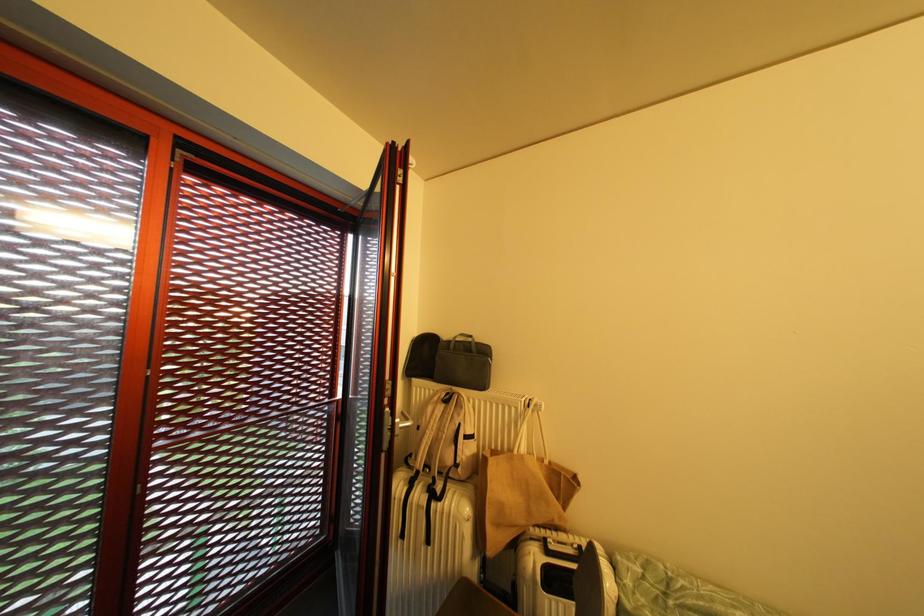
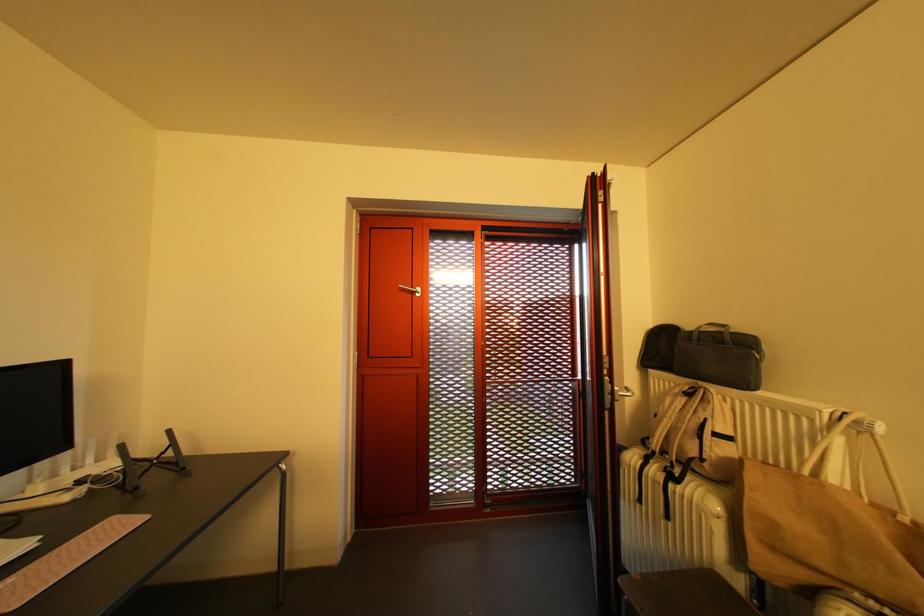
Question: The camera is either moving clockwise (left) or counter-clockwise (right) around the object. The first image is from the beginning of the video and the second image is from the end. Is the camera moving left or right when shooting the video?

Choices:
 (A) Left
 (B) Right

Answer: (B)